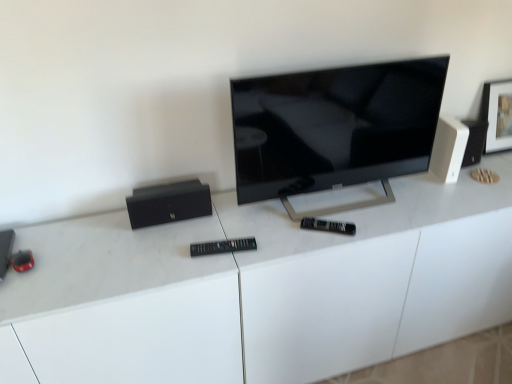
Find the location of `empty space that is in between white plastic speaker at upper right, the 1th speaker when ordered from right to left, and black glossy tv at center`. empty space that is in between white plastic speaker at upper right, the 1th speaker when ordered from right to left, and black glossy tv at center is located at coordinates (370, 189).